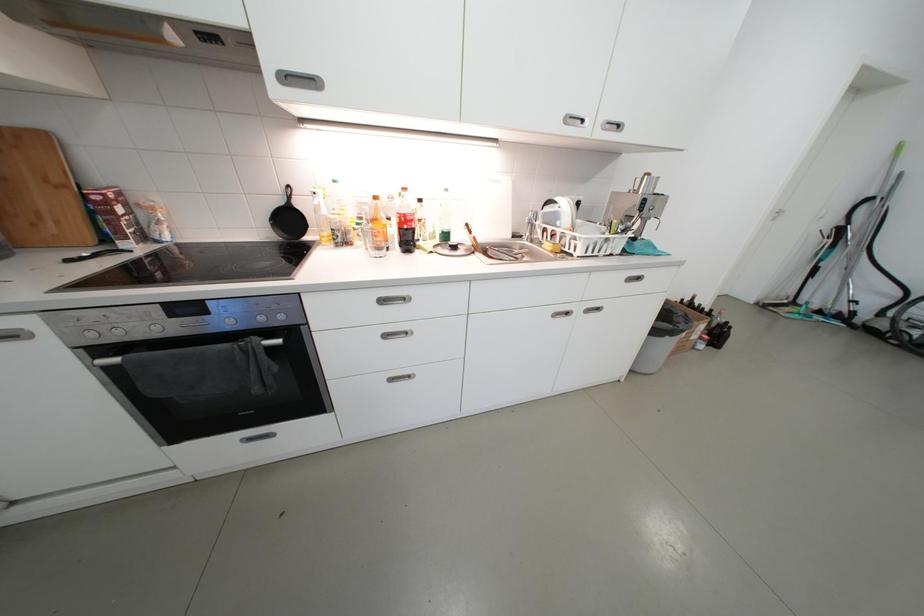
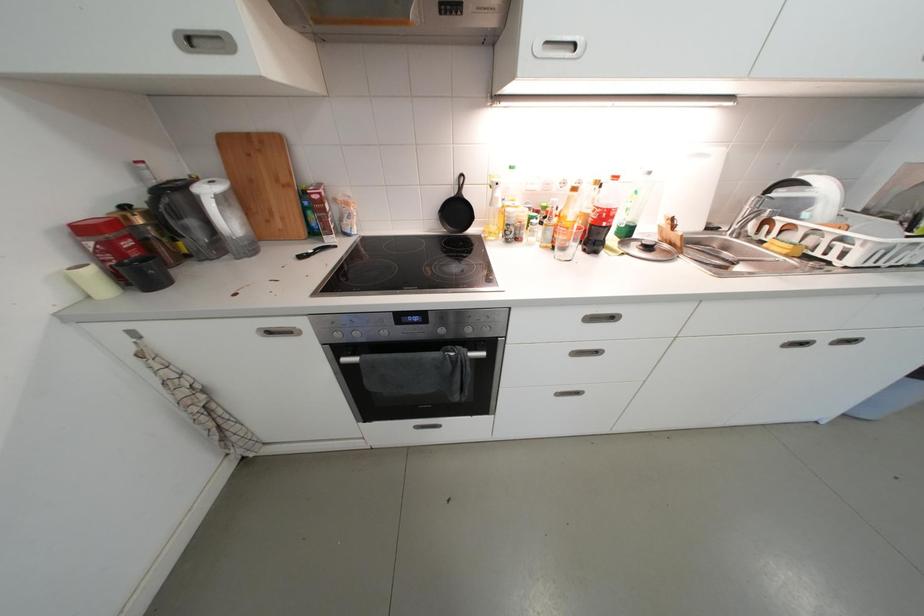
Question: The camera is either moving clockwise (left) or counter-clockwise (right) around the object. The first image is from the beginning of the video and the second image is from the end. Is the camera moving left or right when shooting the video?

Choices:
 (A) Left
 (B) Right

Answer: (B)